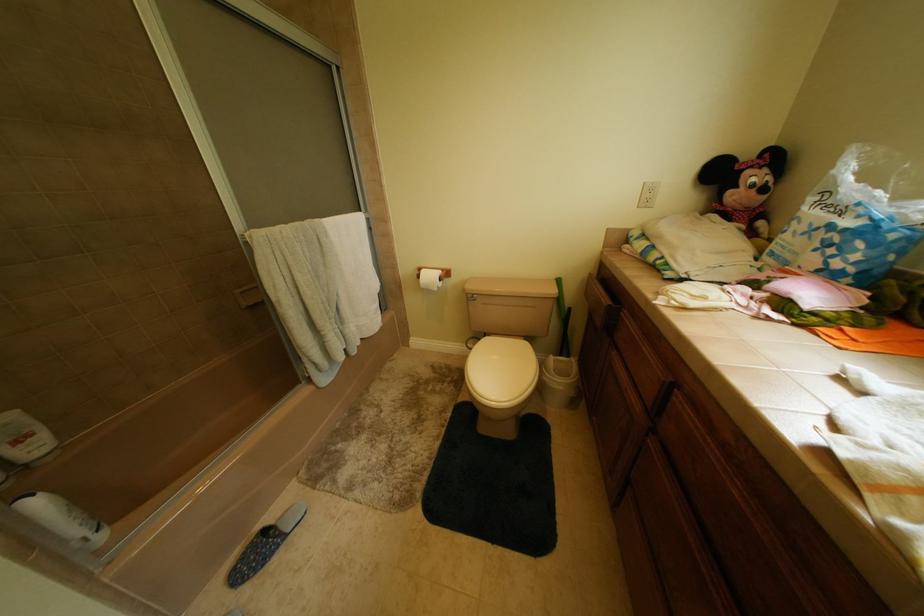
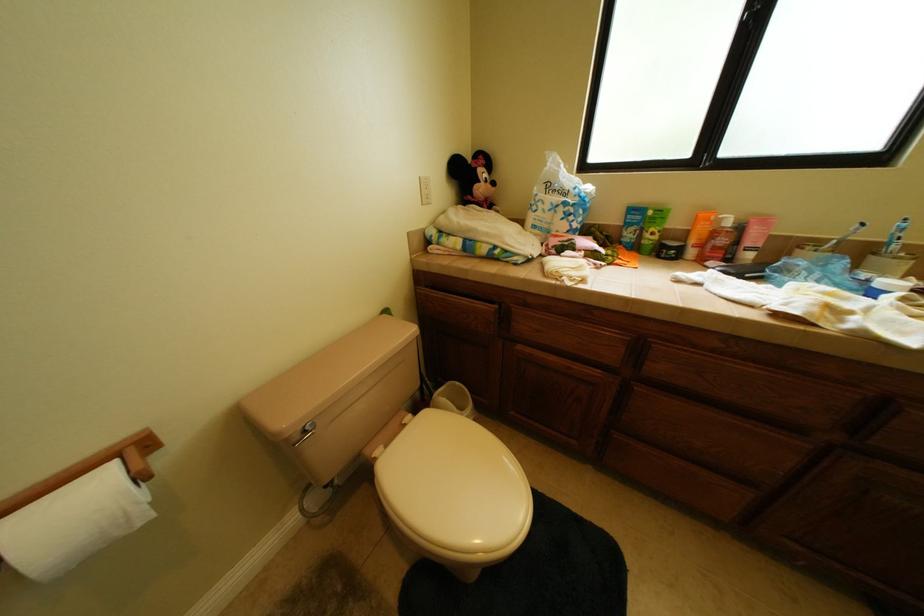
The first image is from the beginning of the video and the second image is from the end. How did the camera likely rotate when shooting the video?

The camera's rotation is toward right-down.